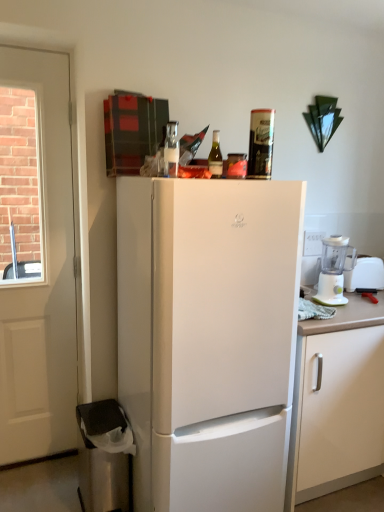
Find the location of a particular element. The image size is (384, 512). vacant area on top of white wooden door at left (from a real-world perspective) is located at coordinates pos(32,47).